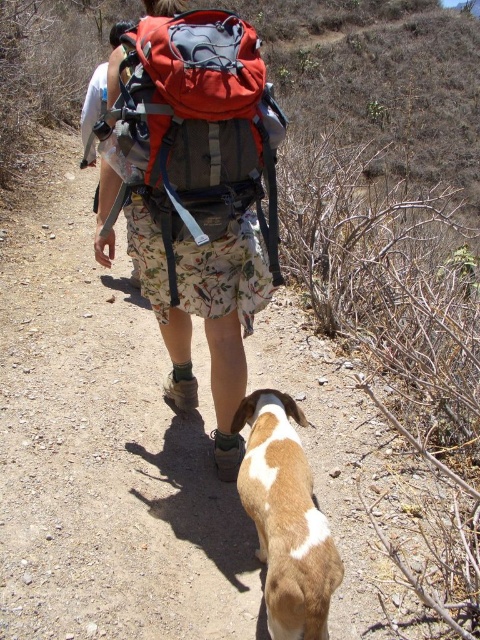
You are a photographer trying to capture the hiker and their dog in a single shot. Given the positions of the matte red backpack at center and the brown and white fur at lower center, which object should you focus on first to ensure both are in frame?

The matte red backpack at center is much taller than the brown and white fur at lower center, so you should focus on the matte red backpack at center first to ensure both are in frame.

Consider the image. You are the hiker in the image and you want to move to the point at coordinates point (224,12). Which direction should you go relative to your current position at point (331,573)?

Since point (224,12) is behind point (331,573), you should move backward to reach it.